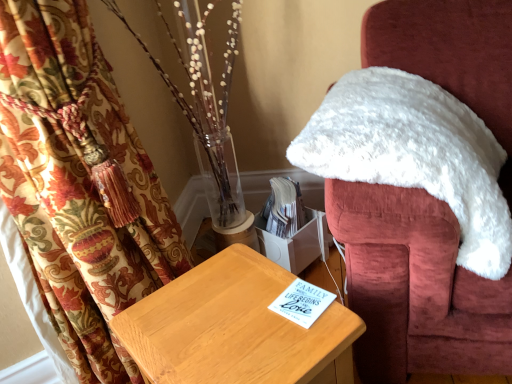
Question: Should I look upward or downward to see white fluffy chair at upper right?

Choices:
 (A) down
 (B) up

Answer: (B)

Question: From the image's perspective, is white fluffy chair at upper right located beneath light brown wooden table at center?

Choices:
 (A) no
 (B) yes

Answer: (A)

Question: Does white fluffy chair at upper right have a larger size compared to light brown wooden table at center?

Choices:
 (A) yes
 (B) no

Answer: (A)

Question: Considering the relative sizes of white fluffy chair at upper right and light brown wooden table at center in the image provided, is white fluffy chair at upper right smaller than light brown wooden table at center?

Choices:
 (A) no
 (B) yes

Answer: (A)

Question: Is white fluffy chair at upper right at the left side of light brown wooden table at center?

Choices:
 (A) yes
 (B) no

Answer: (B)

Question: Is white fluffy chair at upper right at the right side of light brown wooden table at center?

Choices:
 (A) yes
 (B) no

Answer: (A)

Question: Is white fluffy chair at upper right taller than light brown wooden table at center?

Choices:
 (A) yes
 (B) no

Answer: (A)

Question: Is white fluffy chair at upper right inside light brown wooden table at center?

Choices:
 (A) no
 (B) yes

Answer: (A)

Question: From a real-world perspective, is light brown wooden table at center below white fluffy chair at upper right?

Choices:
 (A) no
 (B) yes

Answer: (B)

Question: Is light brown wooden table at center not near white fluffy chair at upper right?

Choices:
 (A) yes
 (B) no

Answer: (B)

Question: Is light brown wooden table at center further to camera compared to white fluffy chair at upper right?

Choices:
 (A) no
 (B) yes

Answer: (A)

Question: From the image's perspective, does light brown wooden table at center appear lower than white fluffy chair at upper right?

Choices:
 (A) yes
 (B) no

Answer: (A)

Question: Considering the relative positions of light brown wooden table at center and white fluffy chair at upper right in the image provided, is light brown wooden table at center to the left of white fluffy chair at upper right from the viewer's perspective?

Choices:
 (A) no
 (B) yes

Answer: (B)

Question: Considering the positions of point (144, 354) and point (463, 72), is point (144, 354) closer or farther from the camera than point (463, 72)?

Choices:
 (A) farther
 (B) closer

Answer: (B)